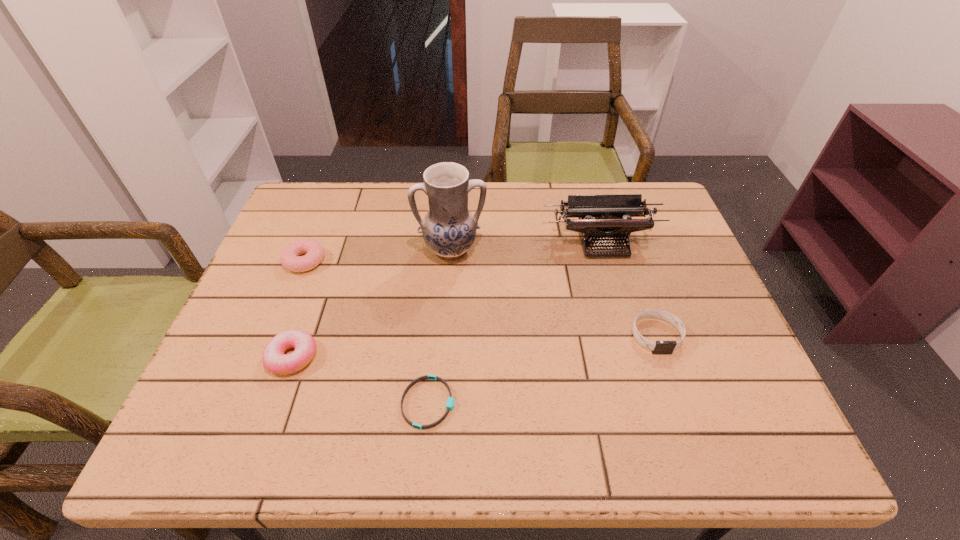
I want to click on free area in between the fifth shortest object and the tallest object, so click(x=527, y=246).

Find the location of a particular element. The image size is (960, 540). vacant space that's between the tallest object and the second tallest object is located at coordinates (527, 246).

Image resolution: width=960 pixels, height=540 pixels. In order to click on vacant region between the taller wristband and the typewriter in this screenshot , I will do `click(629, 288)`.

This screenshot has width=960, height=540. Identify the location of vacant space that is in between the taller wristband and the nearer doughnut. (474, 346).

This screenshot has height=540, width=960. I want to click on object that is the third nearest to the nearer doughnut, so click(449, 229).

Identify which object is the third nearest to the nearer doughnut. Please provide its 2D coordinates. Your answer should be formatted as a tuple, i.e. [(x, y)], where the tuple contains the x and y coordinates of a point satisfying the conditions above.

[(449, 229)]

The width and height of the screenshot is (960, 540). I want to click on vacant space that satisfies the following two spatial constraints: 1. on the front side of the nearer doughnut; 2. on the right side of the farther doughnut, so click(x=266, y=357).

You are a GUI agent. You are given a task and a screenshot of the screen. Output one action in this format:
    pyautogui.click(x=<x>, y=<y>)
    Task: Click on the free spot that satisfies the following two spatial constraints: 1. on the back side of the tallest object; 2. on the left side of the farther doughnut
    
    Given the screenshot: What is the action you would take?
    pyautogui.click(x=309, y=250)